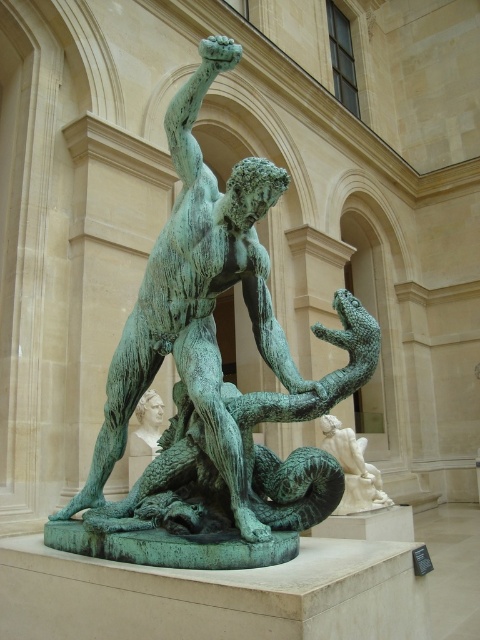
Does green patina bronze statue at center appear on the left side of smooth white marble bust at center?

No, green patina bronze statue at center is not to the left of smooth white marble bust at center.

Which is behind, point (154, 538) or point (149, 401)?

Point (149, 401)

Who is more distant from viewer, (340, 396) or (144, 392)?

Positioned behind is point (144, 392).

Image resolution: width=480 pixels, height=640 pixels. In order to click on green patina bronze statue at center in this screenshot , I will do `click(213, 381)`.

Between white marble statue at center and smooth white marble bust at center, which one has more height?

With more height is white marble statue at center.

Is white marble statue at center positioned before smooth white marble bust at center?

Yes, white marble statue at center is closer to the viewer.

Who is more forward, [355,467] or [156,422]?

Point [156,422]

The image size is (480, 640). Identify the location of white marble statue at center. (352, 468).

Is point (112, 456) behind point (327, 432)?

No, it is in front of (327, 432).

Does green patina bronze statue at center have a greater height compared to white marble statue at center?

Yes, green patina bronze statue at center is taller than white marble statue at center.

Locate an element on the screen. This screenshot has height=640, width=480. green patina bronze statue at center is located at coordinates (213, 381).